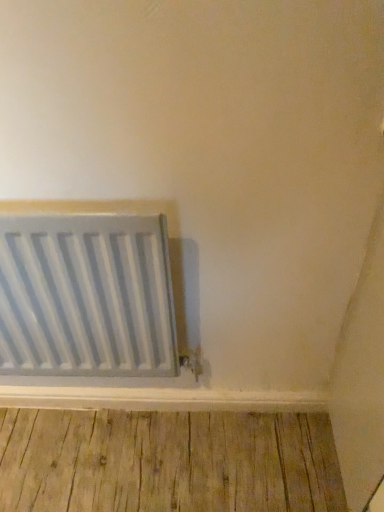
Question: Is metallic silver radiator at lower left inside the boundaries of natural wood floor at bottom, or outside?

Choices:
 (A) inside
 (B) outside

Answer: (B)

Question: Looking at their shapes, would you say metallic silver radiator at lower left is wider or thinner than natural wood floor at bottom?

Choices:
 (A) wide
 (B) thin

Answer: (B)

Question: Considering the positions of metallic silver radiator at lower left and natural wood floor at bottom in the image, is metallic silver radiator at lower left bigger or smaller than natural wood floor at bottom?

Choices:
 (A) big
 (B) small

Answer: (A)

Question: Based on their sizes in the image, would you say natural wood floor at bottom is bigger or smaller than metallic silver radiator at lower left?

Choices:
 (A) big
 (B) small

Answer: (B)

Question: From a real-world perspective, is natural wood floor at bottom physically located above or below metallic silver radiator at lower left?

Choices:
 (A) above
 (B) below

Answer: (B)

Question: From the image's perspective, is natural wood floor at bottom located above or below metallic silver radiator at lower left?

Choices:
 (A) below
 (B) above

Answer: (A)

Question: Would you say natural wood floor at bottom is to the left or to the right of metallic silver radiator at lower left in the picture?

Choices:
 (A) right
 (B) left

Answer: (A)